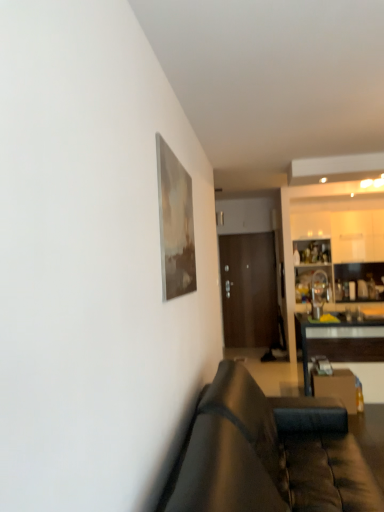
Question: Can you confirm if black glossy table at right is positioned to the left of leather couch at lower right?

Choices:
 (A) no
 (B) yes

Answer: (A)

Question: Is black glossy table at right in front of leather couch at lower right?

Choices:
 (A) yes
 (B) no

Answer: (B)

Question: Does black glossy table at right have a lesser height compared to leather couch at lower right?

Choices:
 (A) no
 (B) yes

Answer: (B)

Question: Is leather couch at lower right at the back of black glossy table at right?

Choices:
 (A) no
 (B) yes

Answer: (A)

Question: Is black glossy table at right outside of leather couch at lower right?

Choices:
 (A) no
 (B) yes

Answer: (B)

Question: From a real-world perspective, is leather couch at lower right above or below black glossy table at right?

Choices:
 (A) below
 (B) above

Answer: (B)

Question: From the image's perspective, relative to black glossy table at right, is leather couch at lower right above or below?

Choices:
 (A) below
 (B) above

Answer: (A)

Question: Does point (319, 445) appear closer or farther from the camera than point (294, 320)?

Choices:
 (A) farther
 (B) closer

Answer: (B)

Question: Considering the positions of leather couch at lower right and black glossy table at right in the image, is leather couch at lower right taller or shorter than black glossy table at right?

Choices:
 (A) short
 (B) tall

Answer: (B)

Question: Based on their sizes in the image, would you say brown wooden door at center is bigger or smaller than white glossy cabinetry at right?

Choices:
 (A) small
 (B) big

Answer: (B)

Question: In the image, is brown wooden door at center on the left side or the right side of white glossy cabinetry at right?

Choices:
 (A) left
 (B) right

Answer: (A)

Question: From a real-world perspective, is brown wooden door at center above or below white glossy cabinetry at right?

Choices:
 (A) above
 (B) below

Answer: (B)

Question: Considering their positions, is brown wooden door at center located in front of or behind white glossy cabinetry at right?

Choices:
 (A) behind
 (B) front

Answer: (A)

Question: Considering their positions, is white glossy cabinetry at right located in front of or behind brown wooden door at center?

Choices:
 (A) behind
 (B) front

Answer: (B)

Question: Looking at the image, does white glossy cabinetry at right seem bigger or smaller compared to brown wooden door at center?

Choices:
 (A) small
 (B) big

Answer: (A)